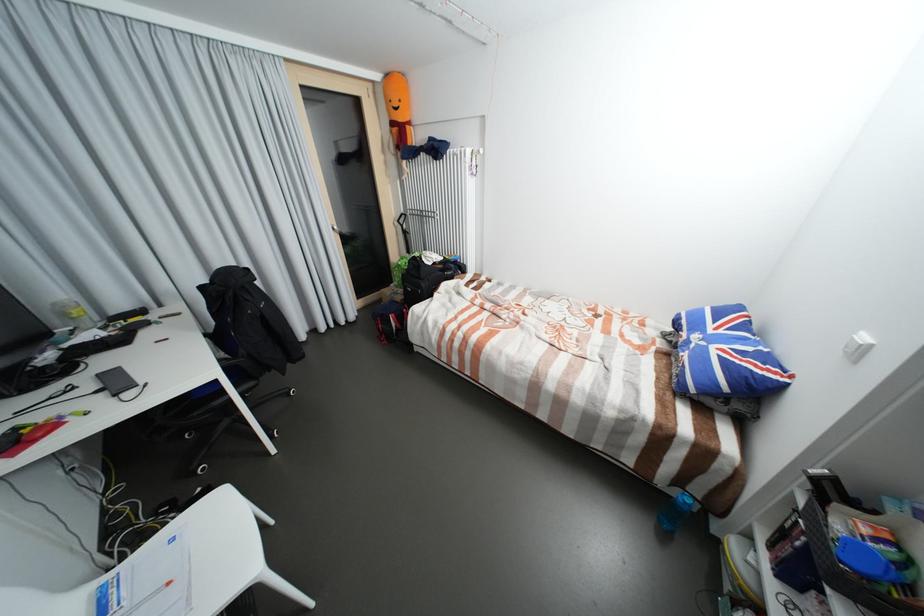
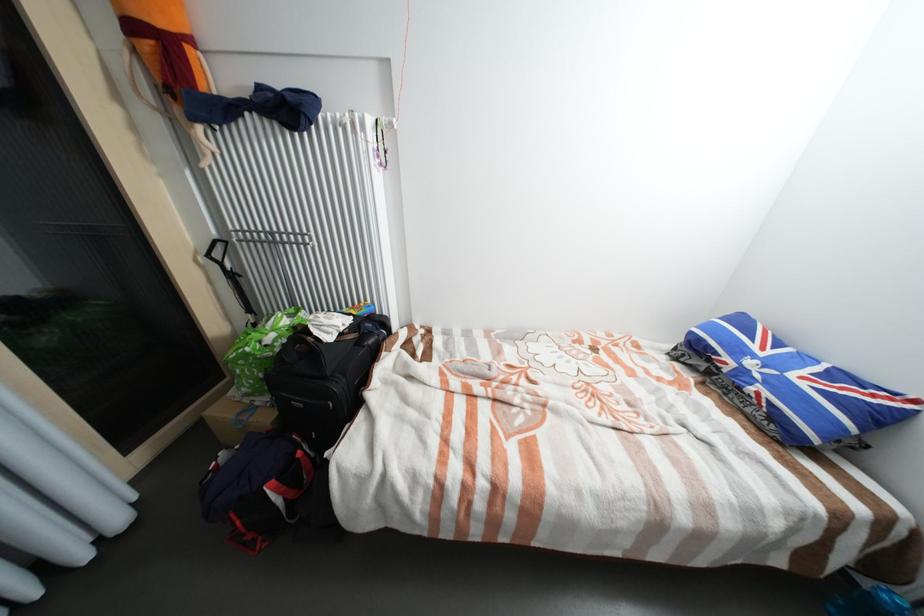
Locate, in the second image, the point that corresponds to point 456,270 in the first image.

(377, 334)